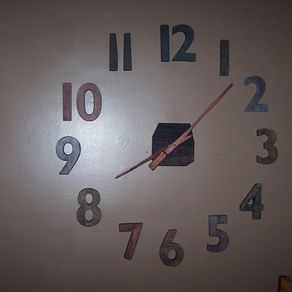
This screenshot has width=292, height=292. Identify the location of light reflection on clock. (99, 137).